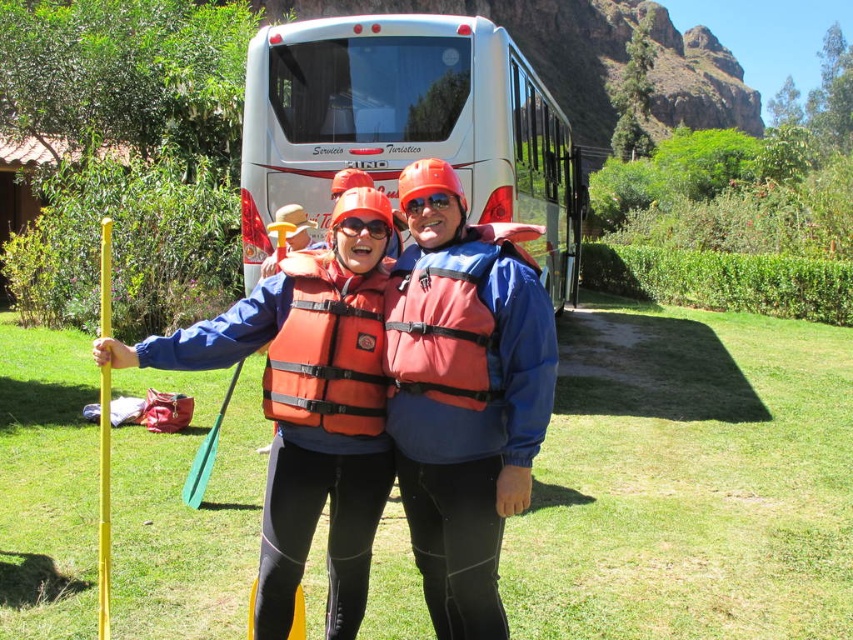
Can you confirm if orange nylon life jacket at center is positioned to the right of transparent plastic goggles at center?

Indeed, orange nylon life jacket at center is positioned on the right side of transparent plastic goggles at center.

Is orange nylon life jacket at center wider than transparent plastic goggles at center?

Yes, orange nylon life jacket at center is wider than transparent plastic goggles at center.

Which is in front, point (496, 340) or point (415, 202)?

Point (496, 340)

In order to click on orange nylon life jacket at center in this screenshot , I will do click(450, 317).

Does orange life jacket at center appear on the left side of transparent plastic goggles at center?

Indeed, orange life jacket at center is positioned on the left side of transparent plastic goggles at center.

Is point (287, 348) positioned in front of point (437, 193)?

No, it is not.

Which is in front, point (366, 300) or point (415, 205)?

Positioned in front is point (415, 205).

Where is `orange life jacket at center`? Image resolution: width=853 pixels, height=640 pixels. orange life jacket at center is located at coordinates (328, 348).

Between orange matte goggles at center and transparent plastic goggles at center, which one is positioned higher?

transparent plastic goggles at center

Which is in front, point (340, 227) or point (434, 204)?

Positioned in front is point (434, 204).

The width and height of the screenshot is (853, 640). Identify the location of orange matte goggles at center. (363, 227).